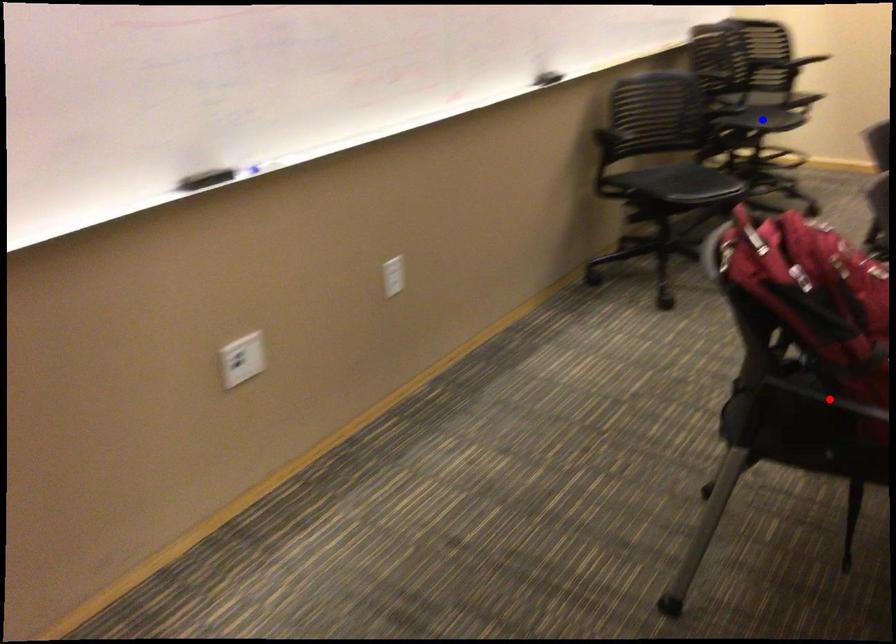
Question: Two points are marked on the image. Which point is closer to the camera?

Choices:
 (A) Blue point is closer.
 (B) Red point is closer.

Answer: (B)